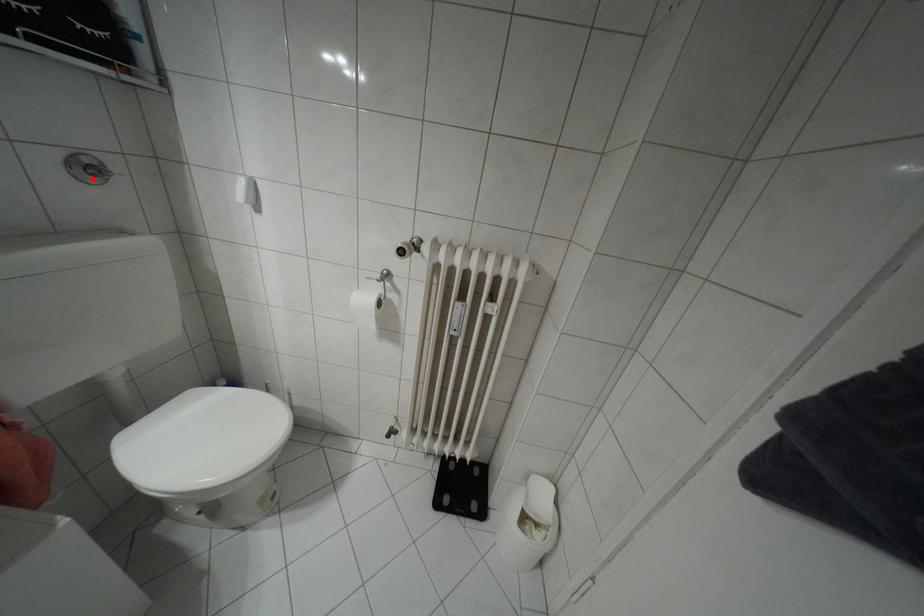
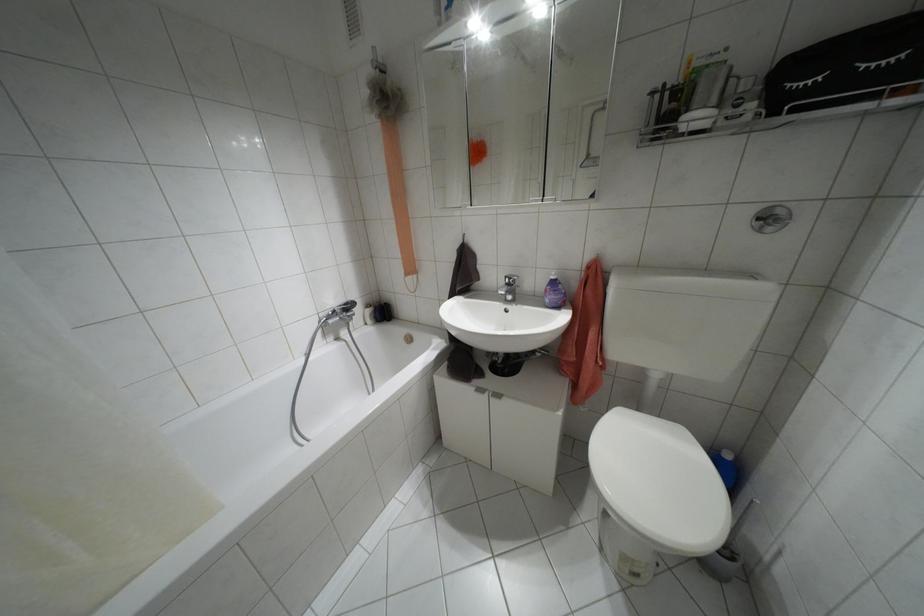
The point at the highlighted location is marked in the first image. Where is the corresponding point in the second image?

(769, 228)